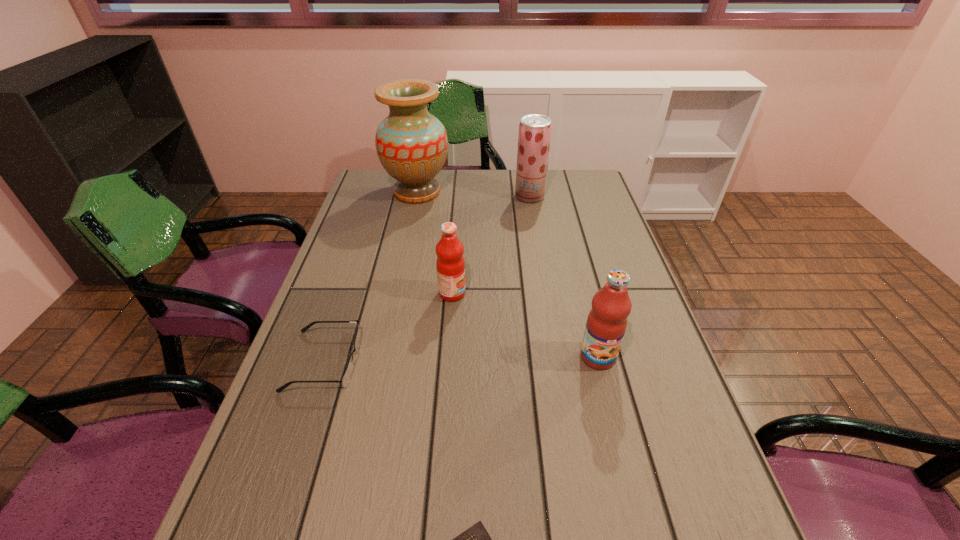
This screenshot has width=960, height=540. Identify the location of free spot between the second fruit juice from left to right and the tallest object. (473, 194).

Where is `free space between the tallest object and the nearest fruit juice`? free space between the tallest object and the nearest fruit juice is located at coordinates 508,274.

This screenshot has height=540, width=960. Identify the location of free space between the fourth nearest object and the rightmost object. (525, 325).

Identify the location of the second closest object to the second shortest object. This screenshot has height=540, width=960. (476, 539).

Point out which object is positioned as the second nearest to the spectacles. Please provide its 2D coordinates. Your answer should be formatted as a tuple, i.e. [(x, y)], where the tuple contains the x and y coordinates of a point satisfying the conditions above.

[(476, 539)]

Select which fruit juice is the second closest to the rightmost fruit juice. Please provide its 2D coordinates. Your answer should be formatted as a tuple, i.e. [(x, y)], where the tuple contains the x and y coordinates of a point satisfying the conditions above.

[(534, 136)]

Find the location of a particular element. Image resolution: width=960 pixels, height=540 pixels. fruit juice that is the third closest to the tallest object is located at coordinates (606, 324).

In order to click on free spot that satisfies the following two spatial constraints: 1. on the front label of the nearest fruit juice; 2. on the front-facing side of the spectacles in this screenshot , I will do `click(599, 361)`.

I want to click on free location that satisfies the following two spatial constraints: 1. on the front side of the second fruit juice from right to left; 2. on the front label of the leftmost fruit juice, so click(x=545, y=293).